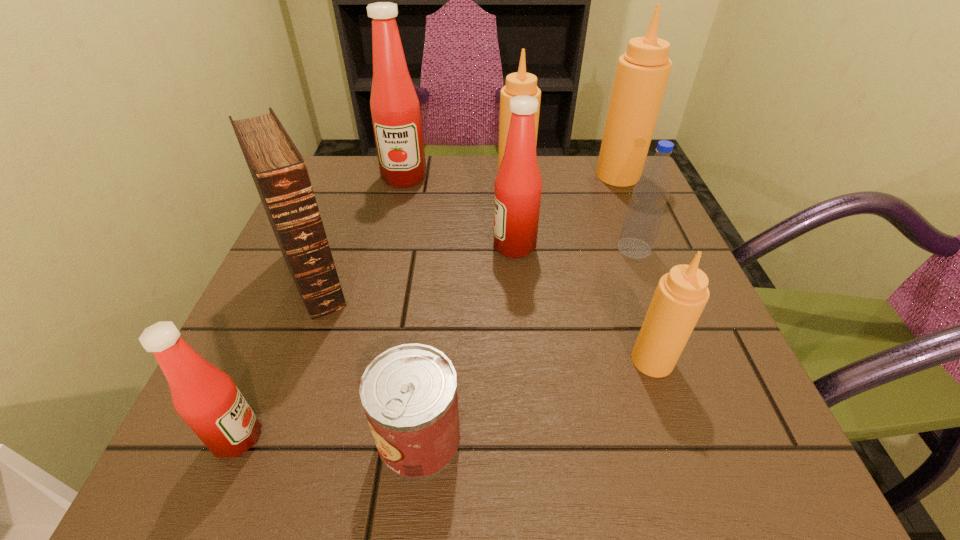
The width and height of the screenshot is (960, 540). In order to click on free point between the leftmost condiment and the Bible in this screenshot , I will do `click(276, 358)`.

Where is `free space between the leftmost tan condiment and the smallest tan condiment`? free space between the leftmost tan condiment and the smallest tan condiment is located at coordinates (584, 270).

The width and height of the screenshot is (960, 540). Find the location of `free space between the smallest tan condiment and the biggest tan condiment`. free space between the smallest tan condiment and the biggest tan condiment is located at coordinates (636, 268).

Find the location of a particular element. unoccupied position between the biggest tan condiment and the Bible is located at coordinates (466, 227).

Locate which object is the fifth closest to the Bible. Please provide its 2D coordinates. Your answer should be formatted as a tuple, i.e. [(x, y)], where the tuple contains the x and y coordinates of a point satisfying the conditions above.

[(520, 83)]

I want to click on object that is the third closest to the nearest red condiment, so click(x=518, y=185).

At what (x,y) coordinates should I click in order to perform the action: click on condiment that stands as the closest to the second biggest tan condiment. Please return your answer as a coordinate pair (x, y). The height and width of the screenshot is (540, 960). Looking at the image, I should click on (642, 73).

Find the location of a particular element. the closest condiment to the shortest object is located at coordinates (206, 398).

The image size is (960, 540). Find the location of `tan condiment that is the closest to the shortest object`. tan condiment that is the closest to the shortest object is located at coordinates (681, 295).

Where is `the closest tan condiment to the leftmost red condiment`? Image resolution: width=960 pixels, height=540 pixels. the closest tan condiment to the leftmost red condiment is located at coordinates (681, 295).